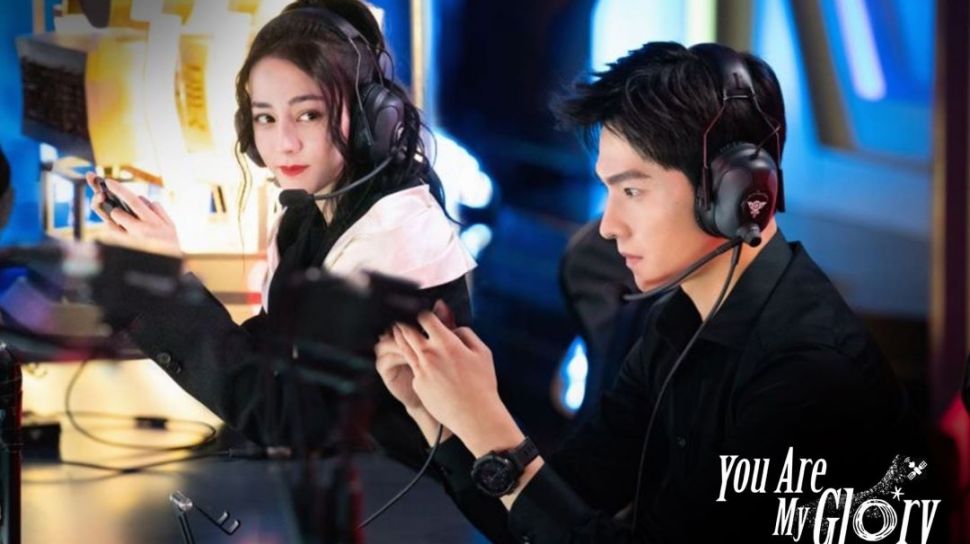
Where is `table`? Image resolution: width=970 pixels, height=544 pixels. table is located at coordinates (261, 475).